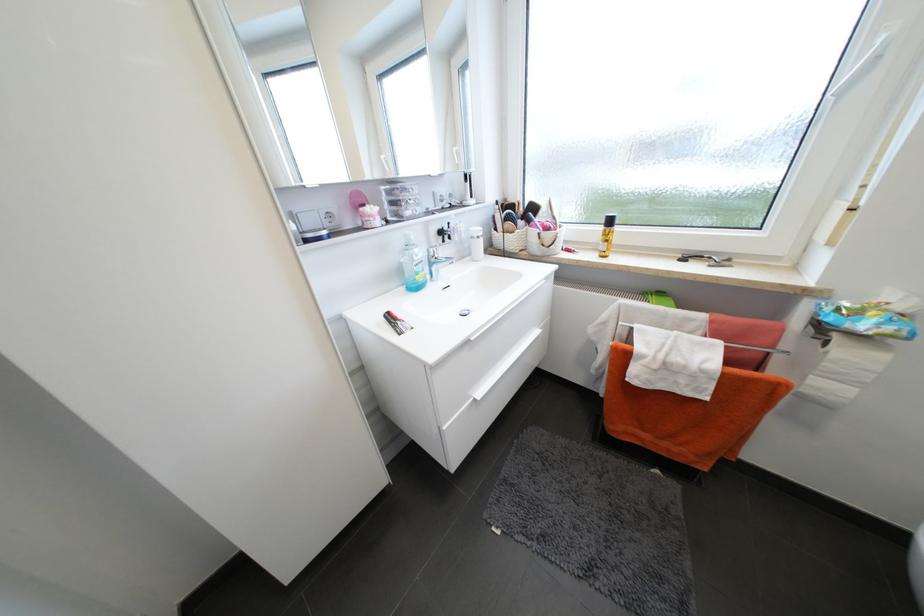
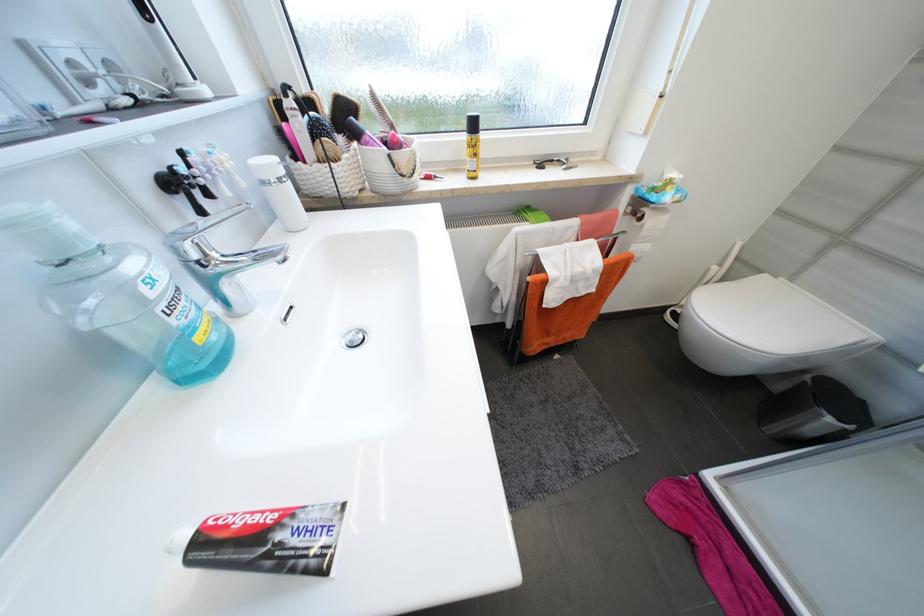
Where in the second image is the point corresponding to the point at 535,223 from the first image?

(362, 136)